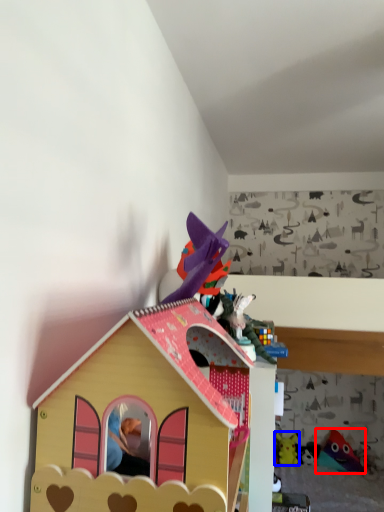
Question: Among these objects, which one is farthest to the camera, toy (highlighted by a red box) or toy (highlighted by a blue box)?

Choices:
 (A) toy
 (B) toy

Answer: (B)